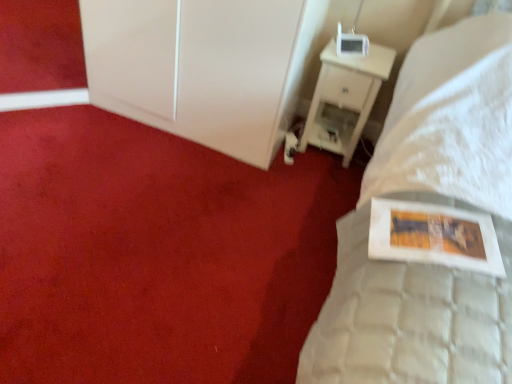
At what (x,y) coordinates should I click in order to perform the action: click on vacant space in front of white wood nightstand at upper right. Please return your answer as a coordinate pair (x, y). Looking at the image, I should click on (311, 177).